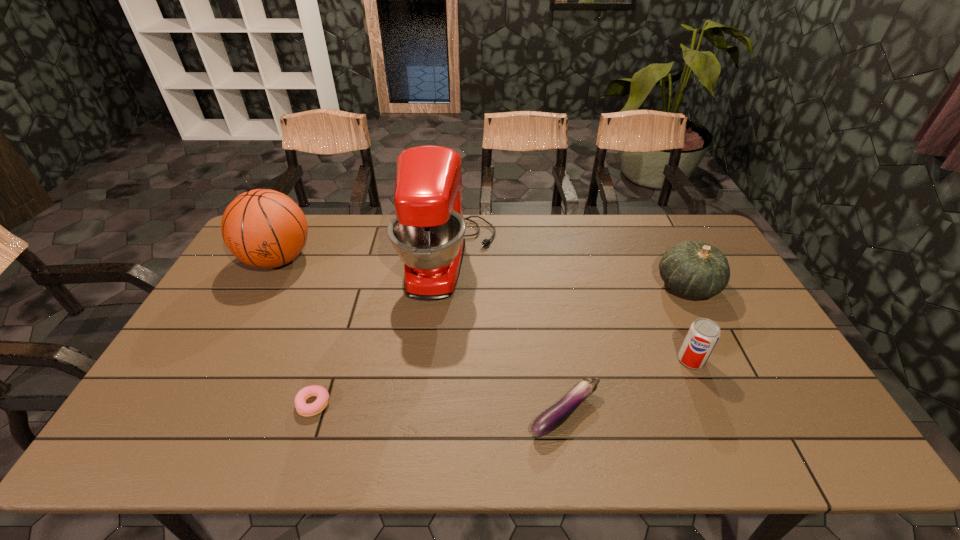
Identify the location of object that is at the left edge. (263, 228).

Identify the location of object that is at the right edge. (694, 269).

Where is `object at the far left corner`? The image size is (960, 540). object at the far left corner is located at coordinates (263, 228).

In the image, there is a desktop. Identify the location of vacant space at the far edge. (587, 239).

The height and width of the screenshot is (540, 960). What are the coordinates of `free space at the near edge` in the screenshot? It's located at (625, 443).

In the image, there is a desktop. In order to click on blank space at the left edge in this screenshot , I will do `click(222, 381)`.

I want to click on vacant area at the right edge of the desktop, so click(764, 417).

Locate an element on the screen. vacant space at the near right corner is located at coordinates (780, 440).

In order to click on vacant space in between the gourd and the shortest object in this screenshot , I will do (x=500, y=345).

Where is `free spot between the eggplant and the gourd`? Image resolution: width=960 pixels, height=540 pixels. free spot between the eggplant and the gourd is located at coordinates tap(626, 349).